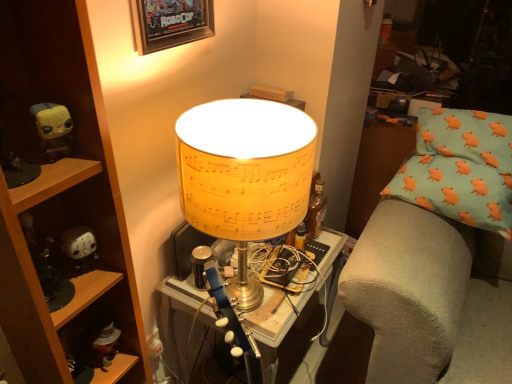
Question: Should I look upward or downward to see matte yellow lampshade at center?

Choices:
 (A) down
 (B) up

Answer: (A)

Question: Are yellow matte toy at left, which is the 1th toy from front to back, and wooden framed poster at upper center making contact?

Choices:
 (A) no
 (B) yes

Answer: (A)

Question: Is yellow matte toy at left, which is the 1th toy from front to back, wider than wooden framed poster at upper center?

Choices:
 (A) yes
 (B) no

Answer: (A)

Question: Considering the relative positions of yellow matte toy at left, positioned as the first toy in top-to-bottom order, and wooden framed poster at upper center in the image provided, is yellow matte toy at left, positioned as the first toy in top-to-bottom order, to the left of wooden framed poster at upper center from the viewer's perspective?

Choices:
 (A) yes
 (B) no

Answer: (A)

Question: Would you say yellow matte toy at left, positioned as the first toy in top-to-bottom order, contains wooden framed poster at upper center?

Choices:
 (A) yes
 (B) no

Answer: (B)

Question: Can you confirm if yellow matte toy at left, which is the 1th toy from front to back, is shorter than wooden framed poster at upper center?

Choices:
 (A) no
 (B) yes

Answer: (B)

Question: Is yellow matte toy at left, which is the 2th toy from back to front, at the right side of wooden framed poster at upper center?

Choices:
 (A) yes
 (B) no

Answer: (B)

Question: From the image's perspective, is matte yellow lampshade at center located beneath wooden framed poster at upper center?

Choices:
 (A) no
 (B) yes

Answer: (B)

Question: Can you confirm if matte yellow lampshade at center is taller than wooden framed poster at upper center?

Choices:
 (A) no
 (B) yes

Answer: (B)

Question: Is matte yellow lampshade at center at the left side of wooden framed poster at upper center?

Choices:
 (A) no
 (B) yes

Answer: (A)

Question: Can you confirm if matte yellow lampshade at center is bigger than wooden framed poster at upper center?

Choices:
 (A) no
 (B) yes

Answer: (B)

Question: From the image's perspective, is matte yellow lampshade at center on wooden framed poster at upper center?

Choices:
 (A) yes
 (B) no

Answer: (B)

Question: Is wooden framed poster at upper center located within matte yellow lampshade at center?

Choices:
 (A) no
 (B) yes

Answer: (A)

Question: From the image's perspective, is wooden shelf at left located beneath matte yellow lampshade at center?

Choices:
 (A) no
 (B) yes

Answer: (A)